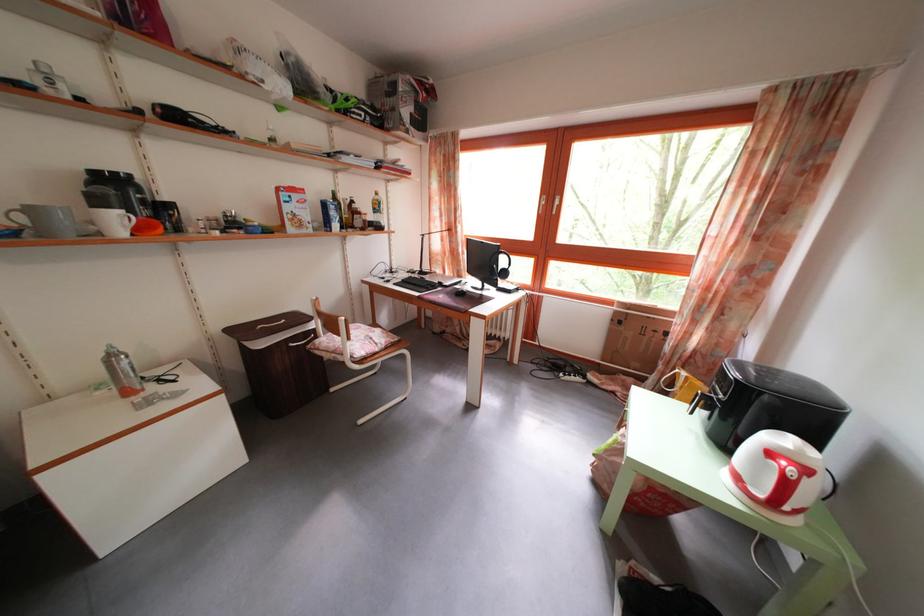
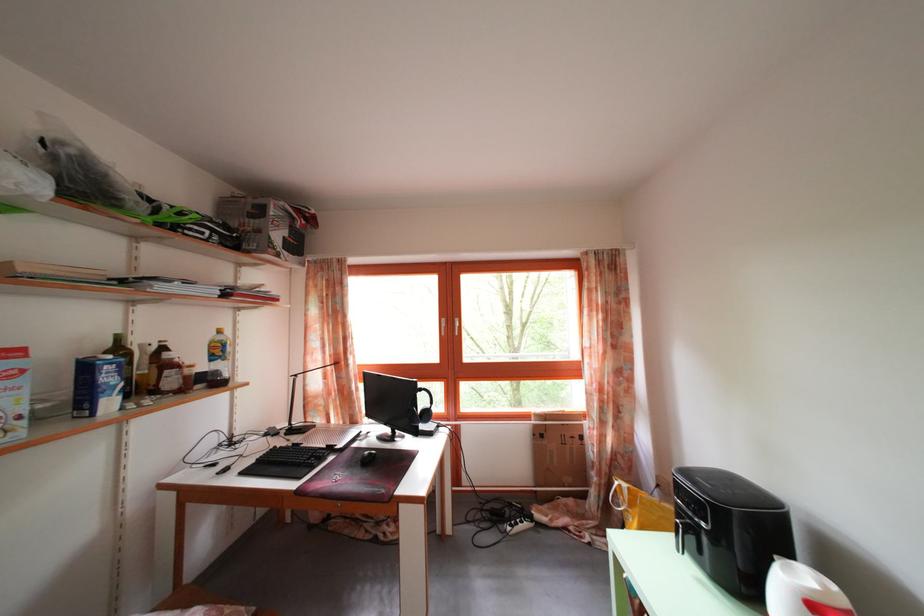
Locate, in the second image, the point that corresponds to (x=342, y=201) in the first image.

(126, 346)